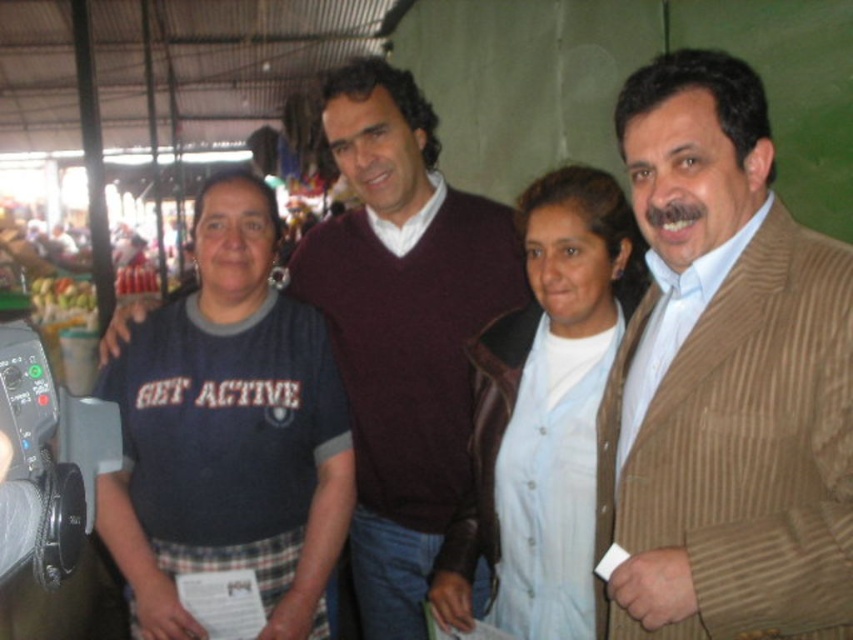
What is the exact location of the maroon sweater at center?

The maroon sweater at center is located at point (403,326).

You are organizing a clothing sale and need to place the brown corduroy jacket at right and the maroon sweater at center into boxes. If the box can only fit items narrower than 30 cm, which item should you prioritize placing first?

The brown corduroy jacket at right has a smaller width than the maroon sweater at center, so it should be prioritized for placement into the box first since it is narrower and more likely to fit within the 30 cm limit.

You are a tailor who needs to determine which fabric to use for a new project. The maroon sweater at center and the light blue fabric at center are available. Which one is bigger in size?

The maroon sweater at center is larger in size than the light blue fabric at center, so you should choose the maroon sweater at center for your project.